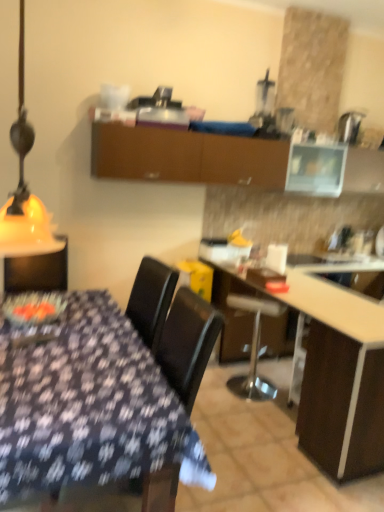
At what (x,y) coordinates should I click in order to perform the action: click on vacant point to the left of metallic silver bar stool at center. Please return your answer as a coordinate pair (x, y). This screenshot has width=384, height=512. Looking at the image, I should click on tap(214, 385).